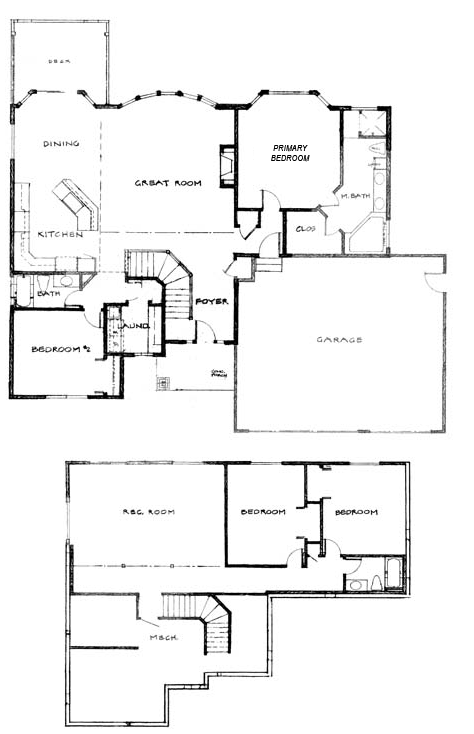
This screenshot has width=474, height=734. In order to click on dining room in this screenshot , I will do `click(69, 138)`.